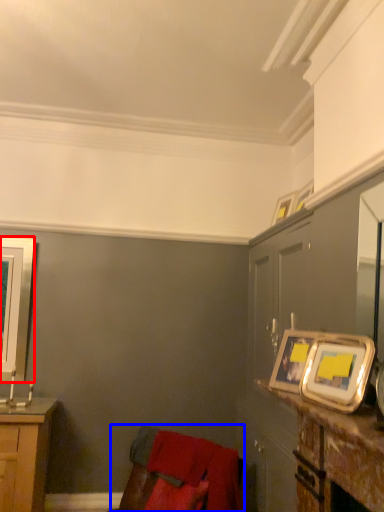
Question: Among these objects, which one is farthest to the camera, picture frame (highlighted by a red box) or swivel chair (highlighted by a blue box)?

Choices:
 (A) picture frame
 (B) swivel chair

Answer: (A)